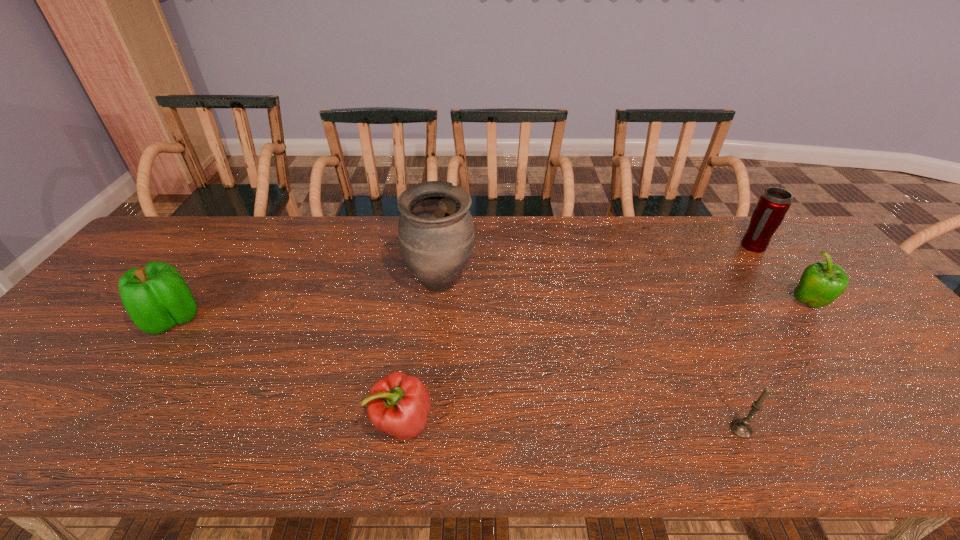
At what (x,y) coordinates should I click in order to perform the action: click on urn. Please return your answer as a coordinate pair (x, y). Looking at the image, I should click on point(436,235).

Where is `the farthest object`? This screenshot has width=960, height=540. the farthest object is located at coordinates (774, 203).

At what (x,y) coordinates should I click in order to perform the action: click on the leftmost bell pepper. Please return your answer as a coordinate pair (x, y). This screenshot has height=540, width=960. Looking at the image, I should click on (156, 297).

Image resolution: width=960 pixels, height=540 pixels. In order to click on the rightmost bell pepper in this screenshot , I will do `click(821, 283)`.

Find the location of `candle`. candle is located at coordinates (742, 428).

Locate an element on the screen. This screenshot has width=960, height=540. the nearest bell pepper is located at coordinates (398, 404).

You are a GUI agent. You are given a task and a screenshot of the screen. Output one action in this format:
    pyautogui.click(x=<x>, y=<y>)
    Task: Click on the shortest bell pepper
    This screenshot has width=960, height=540.
    Given the screenshot: What is the action you would take?
    pyautogui.click(x=398, y=404)

Find the location of `vacant space situated on the left of the tallest object`. vacant space situated on the left of the tallest object is located at coordinates (287, 284).

The width and height of the screenshot is (960, 540). I want to click on vacant space located 0.170m on the side with the handle of the thermos bottle, so click(x=789, y=293).

Identify the location of free space located 0.130m on the left of the leftmost bell pepper. (94, 319).